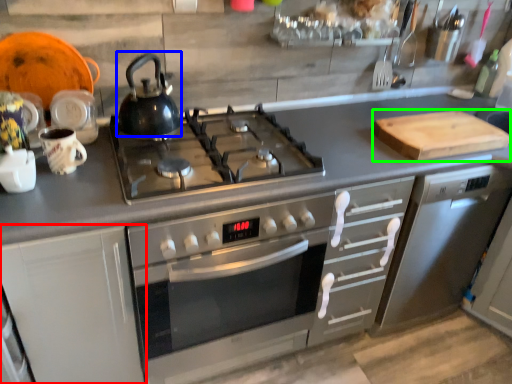
Question: Which object is positioned farthest from cabinetry (highlighted by a red box)? Select from kettle (highlighted by a blue box) and cutting board (highlighted by a green box).

Choices:
 (A) kettle
 (B) cutting board

Answer: (B)